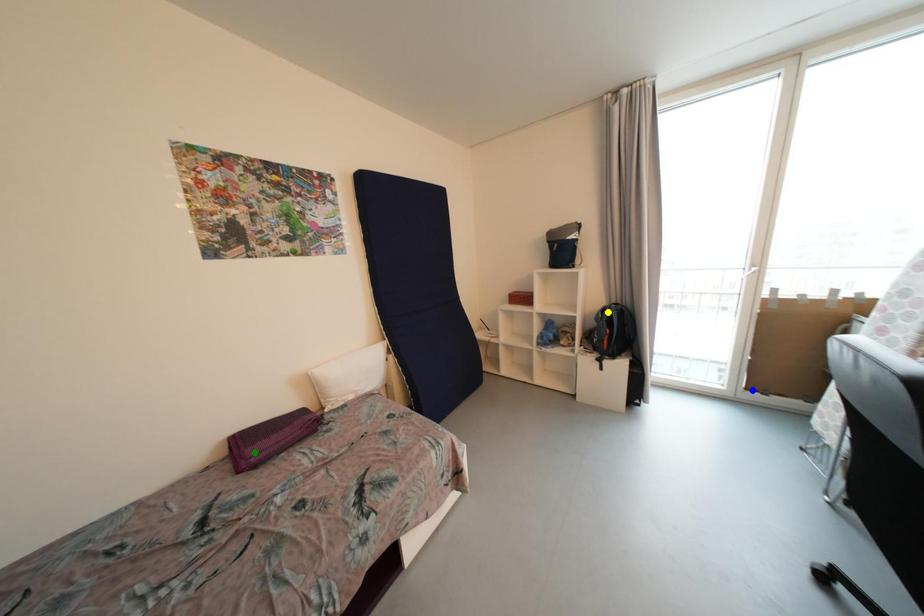
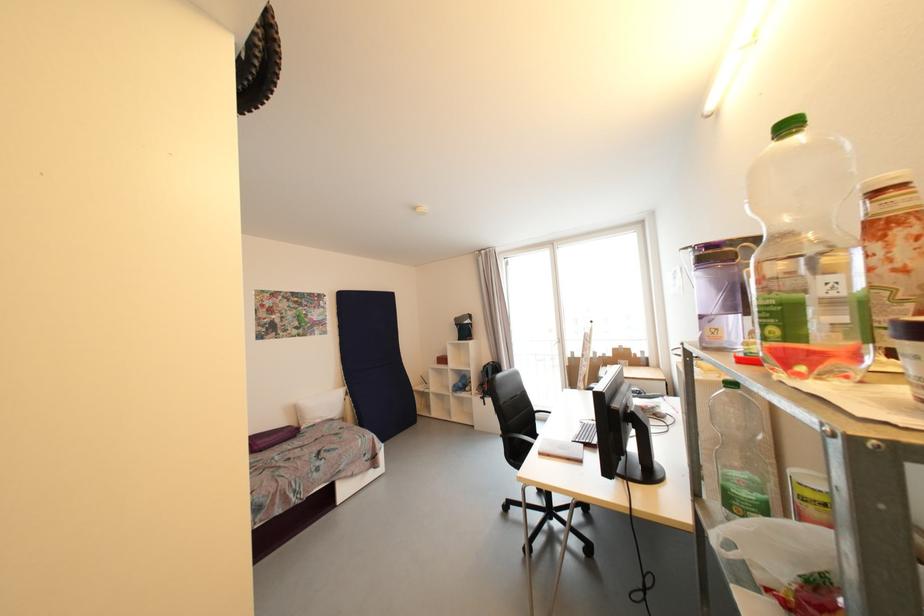
I am providing you with two images of the same scene from different viewpoints. Three points are marked in image1. Which point corresponds to a part or object that is occluded in image2?In image1, three points are marked. Which of them correspond to a part or object that is occluded in image2?Among the three points shown in image1, which one corresponds to a part or object that is no longer visible due to occlusion in image2?

blue point cannot be seen in image2.